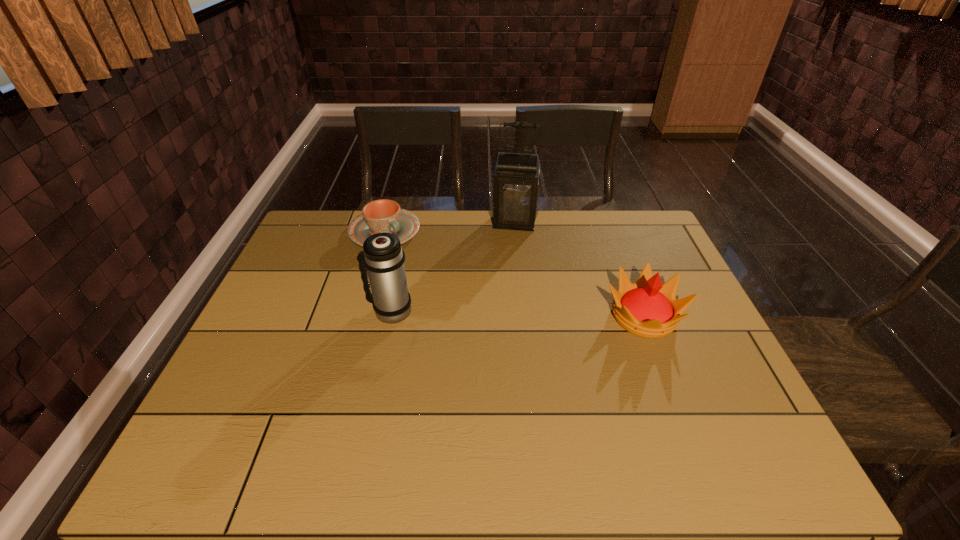
What are the coordinates of `free space that satisfies the following two spatial constraints: 1. on the front side of the third tallest object; 2. on the left side of the shortest object` in the screenshot? It's located at pos(361,316).